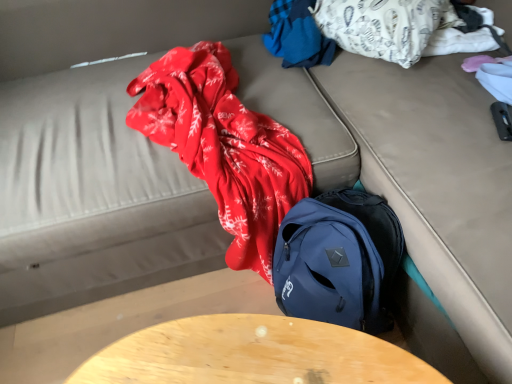
Question: Is white cotton blanket at upper right, which is the 1th clothing in right-to-left order, shorter than blue fabric at upper center, which is the first clothing from left to right?

Choices:
 (A) yes
 (B) no

Answer: (B)

Question: Considering the relative sizes of white cotton blanket at upper right, the second clothing when ordered from left to right, and blue fabric at upper center, arranged as the 2th clothing when viewed from the right, in the image provided, is white cotton blanket at upper right, the second clothing when ordered from left to right, thinner than blue fabric at upper center, arranged as the 2th clothing when viewed from the right,?

Choices:
 (A) no
 (B) yes

Answer: (A)

Question: From a real-world perspective, is white cotton blanket at upper right, the second clothing when ordered from left to right, on top of blue fabric at upper center, which is the first clothing from left to right?

Choices:
 (A) yes
 (B) no

Answer: (A)

Question: Is white cotton blanket at upper right, which is the 1th clothing in right-to-left order, in front of blue fabric at upper center, arranged as the 2th clothing when viewed from the right?

Choices:
 (A) no
 (B) yes

Answer: (B)

Question: Considering the relative positions of white cotton blanket at upper right, which is the 1th clothing in right-to-left order, and blue fabric at upper center, arranged as the 2th clothing when viewed from the right, in the image provided, is white cotton blanket at upper right, which is the 1th clothing in right-to-left order, behind blue fabric at upper center, arranged as the 2th clothing when viewed from the right,?

Choices:
 (A) yes
 (B) no

Answer: (B)

Question: From the image's perspective, is blue fabric at upper center, arranged as the 2th clothing when viewed from the right, located above or below white cotton blanket at upper right, which is the 1th clothing in right-to-left order?

Choices:
 (A) below
 (B) above

Answer: (B)

Question: Relative to white cotton blanket at upper right, which is the 1th clothing in right-to-left order, is blue fabric at upper center, which is the first clothing from left to right, in front or behind?

Choices:
 (A) behind
 (B) front

Answer: (A)

Question: Is blue fabric at upper center, arranged as the 2th clothing when viewed from the right, to the left or to the right of white cotton blanket at upper right, the second clothing when ordered from left to right, in the image?

Choices:
 (A) left
 (B) right

Answer: (A)

Question: Which is correct: blue fabric at upper center, which is the first clothing from left to right, is inside white cotton blanket at upper right, which is the 1th clothing in right-to-left order, or outside of it?

Choices:
 (A) outside
 (B) inside

Answer: (A)

Question: In terms of size, does blue fabric at upper center, arranged as the 2th clothing when viewed from the right, appear bigger or smaller than wooden table at center?

Choices:
 (A) small
 (B) big

Answer: (A)

Question: Is blue fabric at upper center, arranged as the 2th clothing when viewed from the right, wider or thinner than wooden table at center?

Choices:
 (A) wide
 (B) thin

Answer: (A)

Question: Does point (311, 41) appear closer or farther from the camera than point (165, 355)?

Choices:
 (A) farther
 (B) closer

Answer: (A)

Question: From a real-world perspective, is blue fabric at upper center, arranged as the 2th clothing when viewed from the right, above or below wooden table at center?

Choices:
 (A) above
 (B) below

Answer: (A)

Question: Would you say white cotton blanket at upper right, which is the 1th clothing in right-to-left order, is to the left or to the right of blue fabric at upper center, which is the first clothing from left to right, in the picture?

Choices:
 (A) right
 (B) left

Answer: (A)

Question: From a real-world perspective, is white cotton blanket at upper right, the second clothing when ordered from left to right, above or below blue fabric at upper center, arranged as the 2th clothing when viewed from the right?

Choices:
 (A) below
 (B) above

Answer: (B)